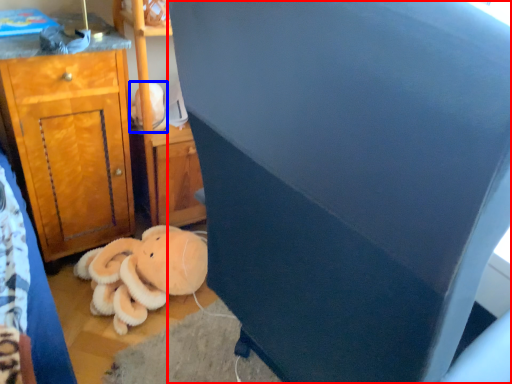
Question: Which object appears farthest to the camera in this image, furniture (highlighted by a red box) or toy (highlighted by a blue box)?

Choices:
 (A) furniture
 (B) toy

Answer: (B)